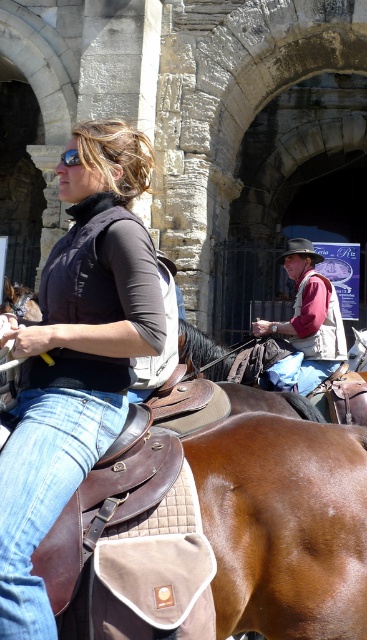
You are a photographer positioned at the center of the scene. You want to capture a photo of the brown felt cowboy hat at center while also including the woman riding the horse in the frame. Based on their positions, can you fit both the hat and the woman in the photo without moving your camera?

The brown felt cowboy hat at center is located at point (299, 250), but since the hat is already at the center, and the woman is in the foreground riding the horse, it is likely that both can be included in the frame without moving the camera.